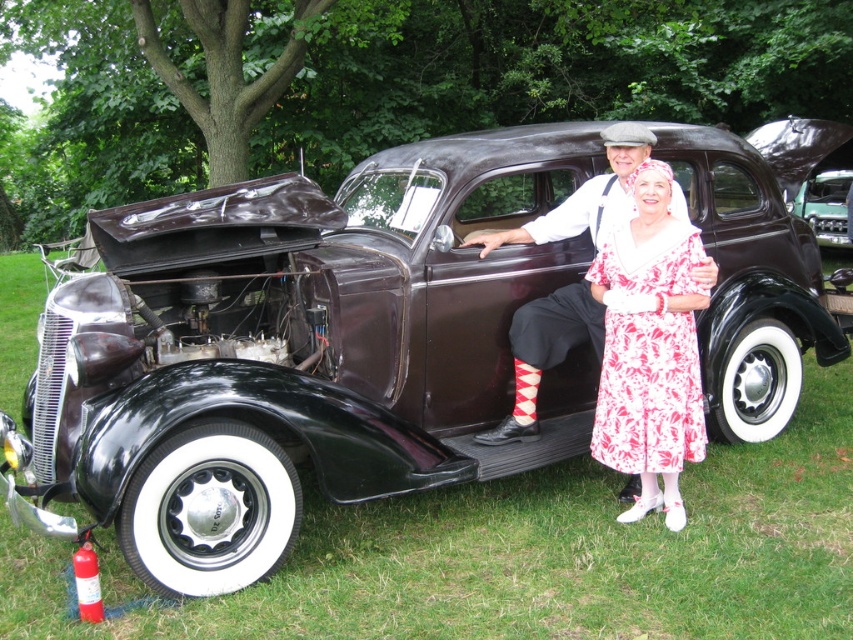
Is floral cotton dress at center wider than printed cotton dress at center?

Incorrect, floral cotton dress at center's width does not surpass printed cotton dress at center's.

Between floral cotton dress at center and printed cotton dress at center, which one appears on the left side from the viewer's perspective?

printed cotton dress at center

The image size is (853, 640). Describe the element at coordinates (650, 344) in the screenshot. I see `floral cotton dress at center` at that location.

The width and height of the screenshot is (853, 640). I want to click on floral cotton dress at center, so click(650, 344).